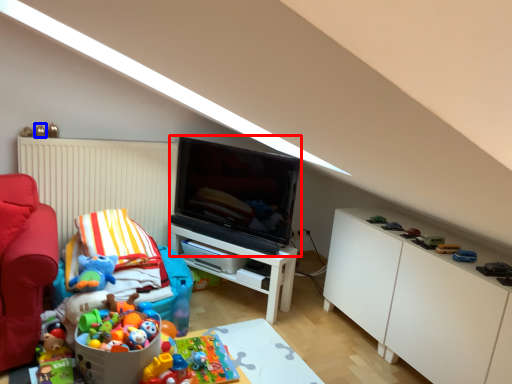
Question: Which object is closer to the camera taking this photo, television (highlighted by a red box) or toy (highlighted by a blue box)?

Choices:
 (A) television
 (B) toy

Answer: (A)